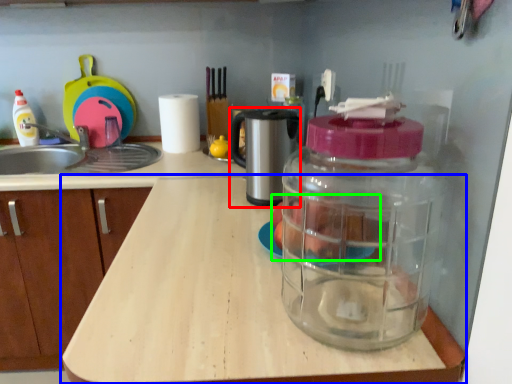
Question: Which object is positioned farthest from coffee machine (highlighted by a red box)? Select from countertop (highlighted by a blue box) and food (highlighted by a green box).

Choices:
 (A) countertop
 (B) food

Answer: (A)